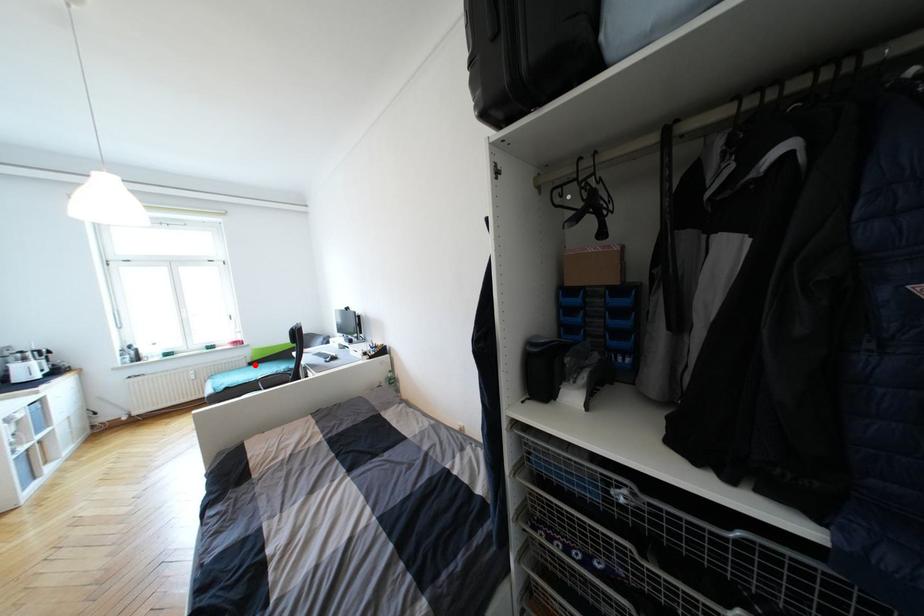
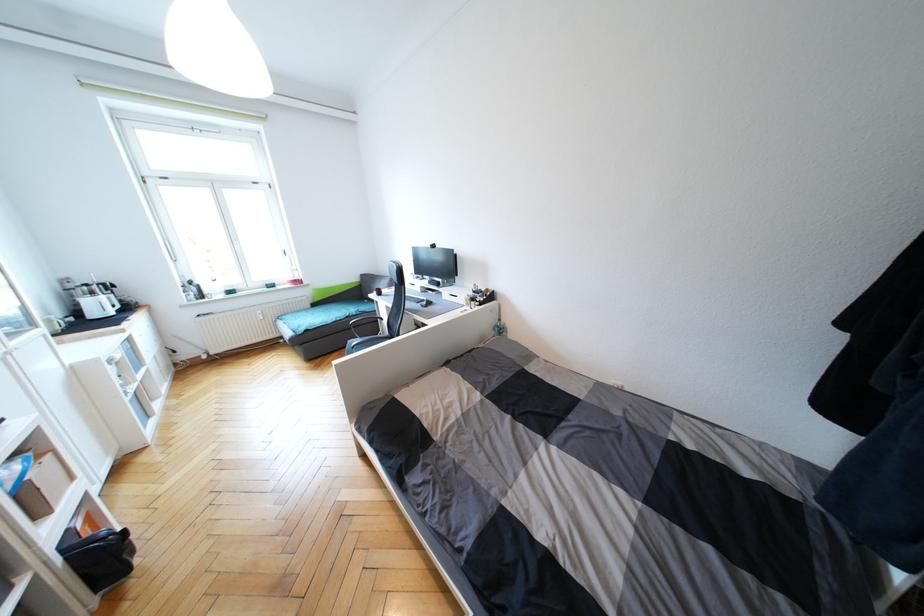
Locate, in the second image, the point that corresponds to the highlighted location in the first image.

(319, 306)